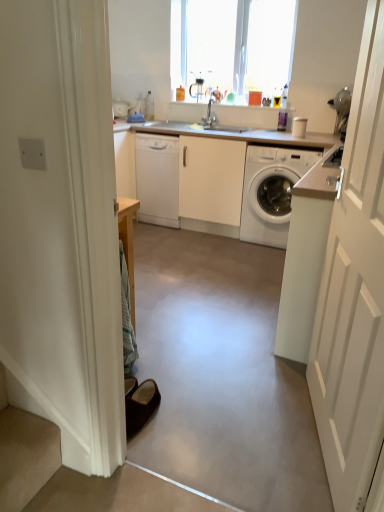
Question: From a real-world perspective, is white wooden door at right located higher than white glossy dishwasher at center?

Choices:
 (A) yes
 (B) no

Answer: (A)

Question: Is white wooden door at right positioned in front of white glossy dishwasher at center?

Choices:
 (A) no
 (B) yes

Answer: (B)

Question: Is white wooden door at right shorter than white glossy dishwasher at center?

Choices:
 (A) no
 (B) yes

Answer: (A)

Question: Is white wooden door at right completely or partially outside of white glossy dishwasher at center?

Choices:
 (A) no
 (B) yes

Answer: (B)

Question: Does white wooden door at right have a smaller size compared to white glossy dishwasher at center?

Choices:
 (A) no
 (B) yes

Answer: (B)

Question: Is there a large distance between white wooden door at right and white glossy dishwasher at center?

Choices:
 (A) yes
 (B) no

Answer: (A)

Question: From the image's perspective, does white wooden door at right appear higher than white glossy washing machine at right?

Choices:
 (A) yes
 (B) no

Answer: (B)

Question: Is white wooden door at right located outside white glossy washing machine at right?

Choices:
 (A) no
 (B) yes

Answer: (B)

Question: Does white wooden door at right have a lesser width compared to white glossy washing machine at right?

Choices:
 (A) yes
 (B) no

Answer: (A)

Question: From a real-world perspective, is white wooden door at right on white glossy washing machine at right?

Choices:
 (A) no
 (B) yes

Answer: (B)

Question: Can you confirm if white wooden door at right is wider than white glossy washing machine at right?

Choices:
 (A) yes
 (B) no

Answer: (B)

Question: Does white wooden door at right have a greater height compared to white glossy washing machine at right?

Choices:
 (A) yes
 (B) no

Answer: (A)

Question: Does white glossy washing machine at right appear on the right side of white wooden door at right?

Choices:
 (A) no
 (B) yes

Answer: (B)